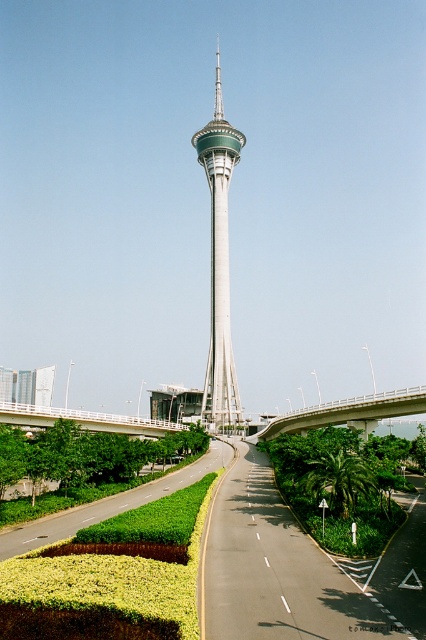
Who is lower down, green metallic tower at center or white concrete bridge at lower center?

white concrete bridge at lower center is below.

Is green metallic tower at center bigger than white concrete bridge at lower center?

Yes.

This screenshot has width=426, height=640. In order to click on green metallic tower at center in this screenshot , I will do `click(218, 262)`.

The width and height of the screenshot is (426, 640). I want to click on green metallic tower at center, so [x=218, y=262].

Between white concrete bridge at center and white concrete bridge at lower center, which one is positioned higher?

white concrete bridge at center is higher up.

Can you confirm if white concrete bridge at center is thinner than white concrete bridge at lower center?

Indeed, white concrete bridge at center has a lesser width compared to white concrete bridge at lower center.

Is point (259, 440) closer to viewer compared to point (181, 428)?

No, it is behind (181, 428).

Locate an element on the screen. The width and height of the screenshot is (426, 640). white concrete bridge at center is located at coordinates (348, 410).

Does green metallic tower at center lie behind white concrete bridge at center?

That is True.

Does green metallic tower at center appear on the left side of white concrete bridge at center?

Correct, you'll find green metallic tower at center to the left of white concrete bridge at center.

Is point (227, 184) positioned in front of point (383, 410)?

No, (227, 184) is further to viewer.

Locate an element on the screen. green metallic tower at center is located at coordinates (218, 262).